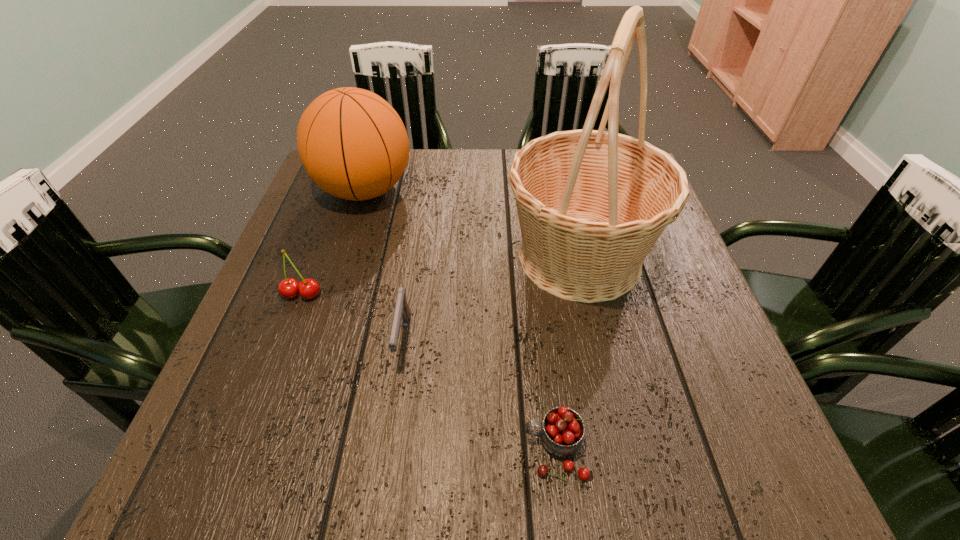
What are the coordinates of `vacant region located 0.380m on the handle side of the nearer cherry` in the screenshot? It's located at (278, 450).

Where is `free space located on the handle side of the nearer cherry`? This screenshot has width=960, height=540. free space located on the handle side of the nearer cherry is located at coordinates (453, 450).

What are the coordinates of `free space located at the barrel of the third object from right to left` in the screenshot? It's located at (393, 416).

Where is `object present at the far edge`? object present at the far edge is located at coordinates (352, 143).

At what (x,y) coordinates should I click in order to perform the action: click on object at the near edge. Please return your answer as a coordinate pair (x, y). The height and width of the screenshot is (540, 960). Looking at the image, I should click on (562, 431).

Find the location of a particular element. The width and height of the screenshot is (960, 540). basketball at the left edge is located at coordinates (352, 143).

I want to click on cherry at the left edge, so click(308, 288).

Identify the location of object that is positioned at the right edge. This screenshot has height=540, width=960. (591, 204).

Find the location of a particular element. The width and height of the screenshot is (960, 540). object located in the far left corner section of the desktop is located at coordinates (352, 143).

Where is `vacant space at the far edge`? vacant space at the far edge is located at coordinates (412, 186).